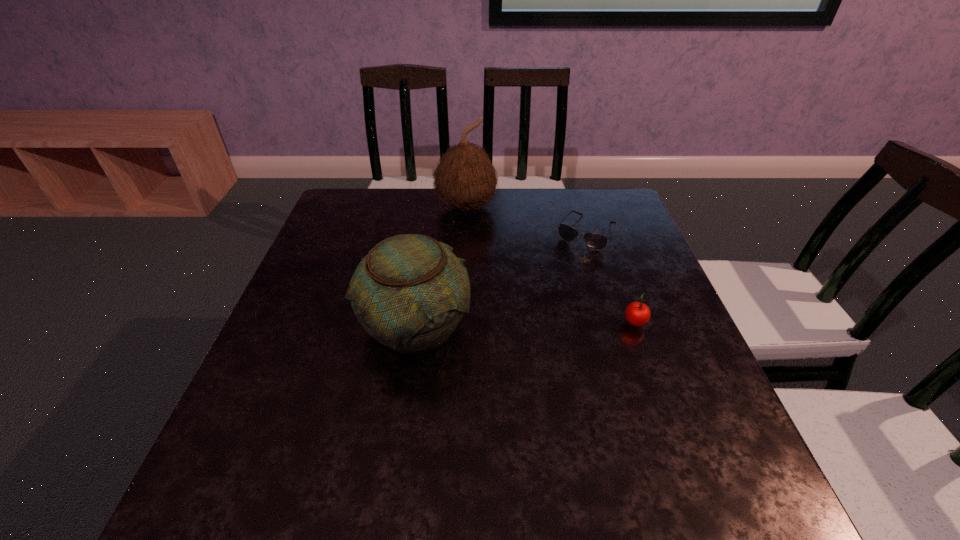
The width and height of the screenshot is (960, 540). What are the coordinates of `vacant space at the right edge of the desktop` in the screenshot? It's located at (638, 276).

The image size is (960, 540). I want to click on free space at the far left corner of the desktop, so click(338, 216).

The image size is (960, 540). I want to click on vacant region at the far right corner, so click(586, 229).

This screenshot has height=540, width=960. What are the coordinates of `free space between the pottery and the second shortest object` in the screenshot? It's located at (525, 325).

At what (x,y) coordinates should I click in order to perform the action: click on free space between the sunglasses and the cherry. Please return your answer as a coordinate pair (x, y). Looking at the image, I should click on (610, 279).

Where is `free space between the second shortest object and the second tallest object`? Image resolution: width=960 pixels, height=540 pixels. free space between the second shortest object and the second tallest object is located at coordinates (525, 325).

Locate an element on the screen. free space between the second shortest object and the sunglasses is located at coordinates (610, 279).

Locate an element on the screen. The width and height of the screenshot is (960, 540). free space between the pottery and the sunglasses is located at coordinates (500, 279).

Find the location of `free space that is in between the shortest object and the third shortest object`. free space that is in between the shortest object and the third shortest object is located at coordinates (500, 279).

Locate an element on the screen. The width and height of the screenshot is (960, 540). free space that is in between the cherry and the third shortest object is located at coordinates (525, 325).